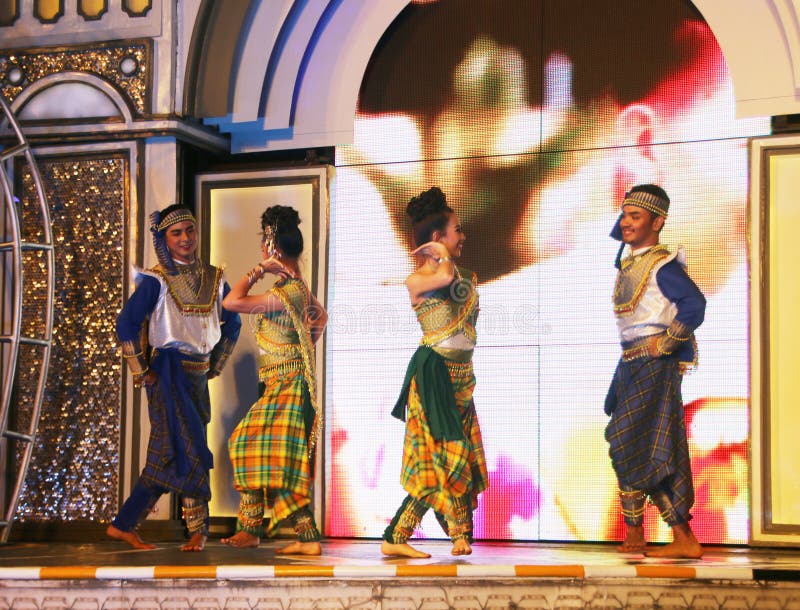
The width and height of the screenshot is (800, 610). What are the coordinates of `stage floor` in the screenshot? It's located at (370, 551).